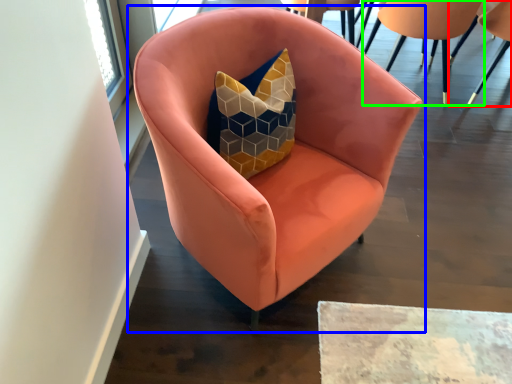
Question: Estimate the real-world distances between objects in this image. Which object is farther from chair (highlighted by a red box), chair (highlighted by a blue box) or chair (highlighted by a green box)?

Choices:
 (A) chair
 (B) chair

Answer: (A)